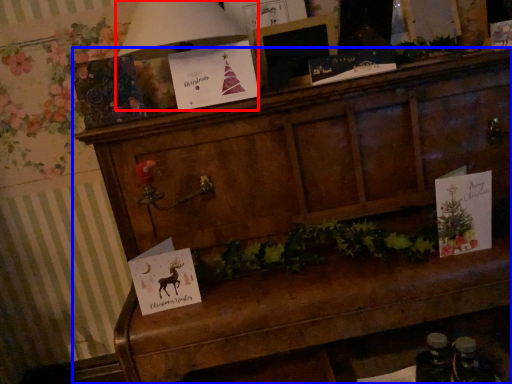
Question: Which of the following is the farthest to the observer, lamp (highlighted by a red box) or furniture (highlighted by a blue box)?

Choices:
 (A) lamp
 (B) furniture

Answer: (A)